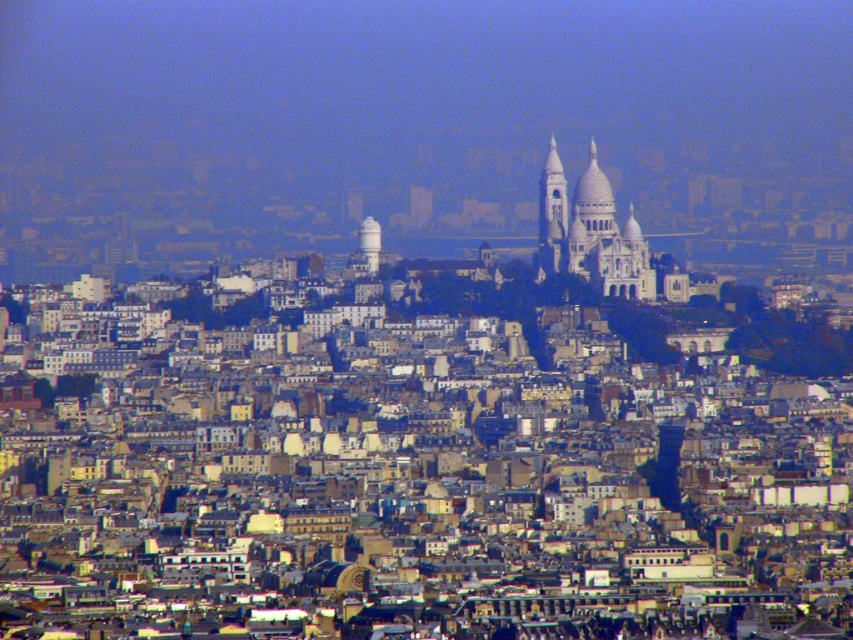
You are a city planner analyzing the urban layout. Given the white stone church at center and the smooth white tower at center, which structure occupies more horizontal space in the image?

The white stone church at center has a greater width than the smooth white tower at center, so it occupies more horizontal space in the image.

You are an architect analyzing the urban layout of this European city. You need to determine the spatial relationship between the white stone church at center and the smooth white tower at center. Which structure is positioned further away from the viewer?

The smooth white tower at center is behind the white stone church at center, so it is positioned further away from the viewer than the white stone church at center.

You are a tourist in Paris and see the white stone church at center and the smooth white tower at center in the distance. Which one is located to the right from your perspective?

The white stone church at center is positioned on the right side of the smooth white tower at center, so the white stone church at center is located to the right.